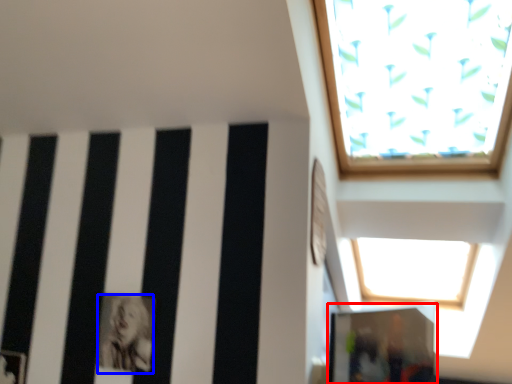
Question: Which point is closer to the camera, glass door (highlighted by a red box) or person (highlighted by a blue box)?

Choices:
 (A) glass door
 (B) person

Answer: (A)